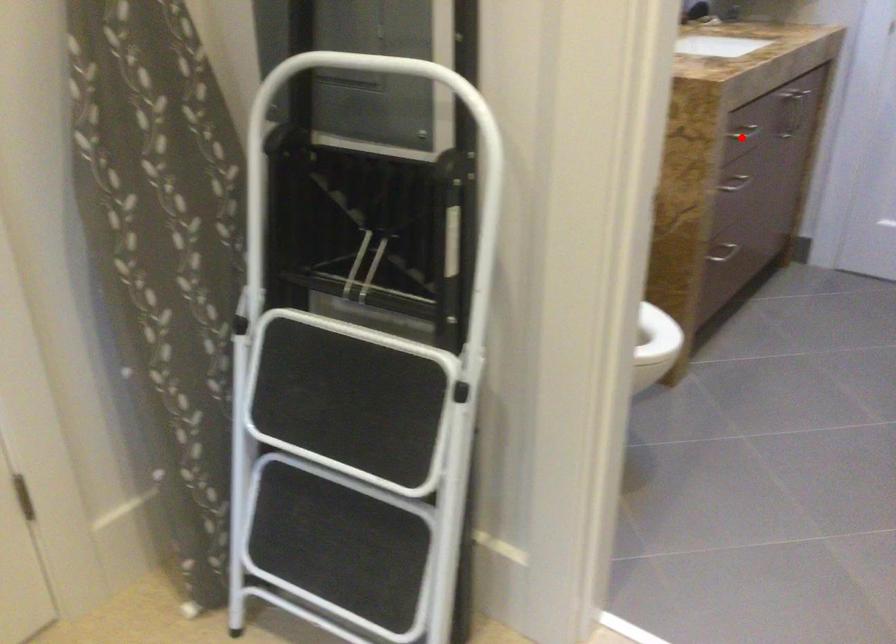
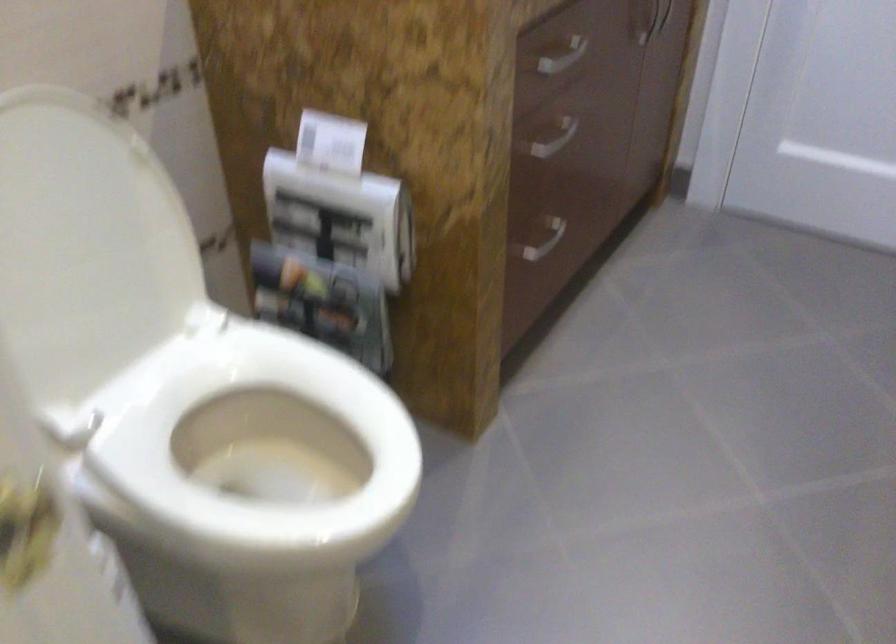
Question: I am providing you with two images of the same scene from different viewpoints. A red point is marked on the first image. At the location where the point appears in image 1, is it still visible in image 2?

Choices:
 (A) Yes
 (B) No

Answer: (A)